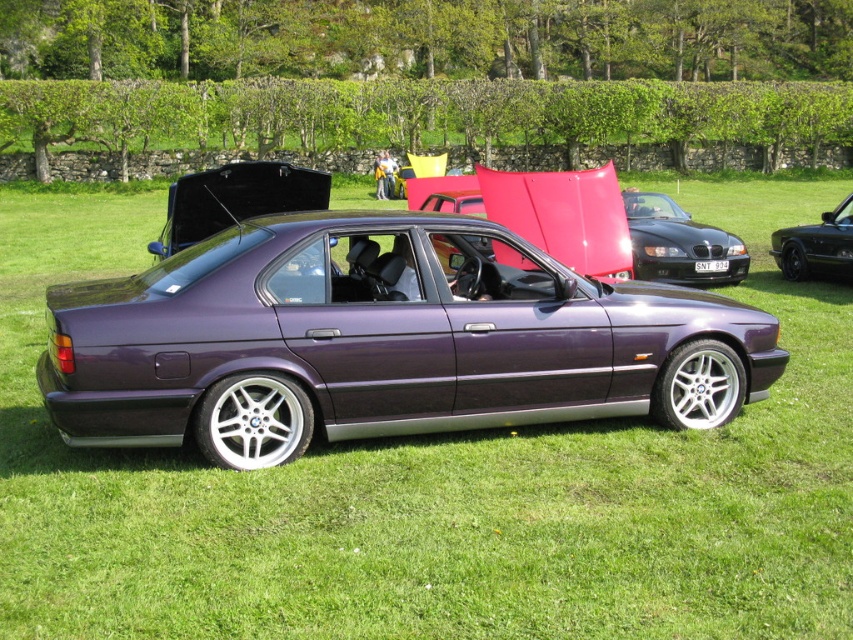
Question: Estimate the real-world distances between objects in this image. Which object is closer to the silver metallic rim at lower right?

Choices:
 (A) matte purple car at center
 (B) silver metallic rim at lower center
 (C) metallic purple car at center
 (D) purple metallic car at center

Answer: (C)

Question: Can you confirm if purple metallic car at center is wider than shiny black sedan at right?

Choices:
 (A) yes
 (B) no

Answer: (A)

Question: Is shiny black sedan at right closer to the viewer compared to matte purple car at center?

Choices:
 (A) no
 (B) yes

Answer: (B)

Question: Does metallic purple car at center have a lesser width compared to matte purple car at center?

Choices:
 (A) yes
 (B) no

Answer: (B)

Question: Which of the following is the farthest from the observer?

Choices:
 (A) silver metallic rim at lower right
 (B) shiny black sedan at right
 (C) purple metallic car at center
 (D) matte purple car at center

Answer: (D)

Question: Which point is farther from the camera taking this photo?

Choices:
 (A) (669, 394)
 (B) (132, 369)

Answer: (A)